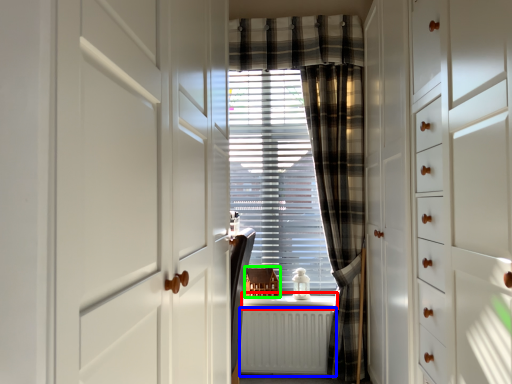
Question: Which object is positioned closest to window sill (highlighted by a red box)? Select from radiator (highlighted by a blue box) and furniture (highlighted by a green box).

Choices:
 (A) radiator
 (B) furniture

Answer: (B)